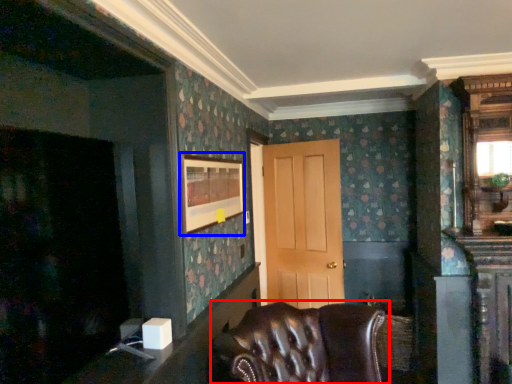
Question: Which object appears closest to the camera in this image, chair (highlighted by a red box) or picture frame (highlighted by a blue box)?

Choices:
 (A) chair
 (B) picture frame

Answer: (A)